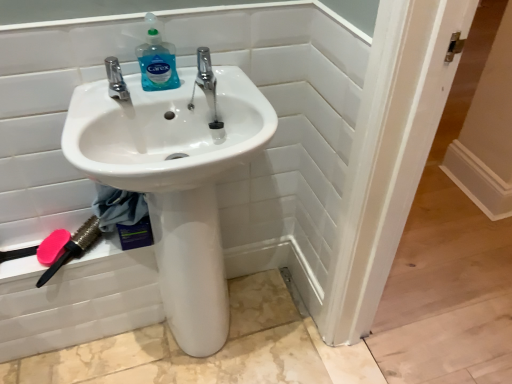
Question: Is there a large distance between pink plastic brush at lower left and translucent plastic bottle at upper center?

Choices:
 (A) no
 (B) yes

Answer: (A)

Question: From a real-world perspective, is pink plastic brush at lower left positioned over translucent plastic bottle at upper center based on gravity?

Choices:
 (A) yes
 (B) no

Answer: (B)

Question: Is pink plastic brush at lower left shorter than translucent plastic bottle at upper center?

Choices:
 (A) yes
 (B) no

Answer: (A)

Question: Considering the relative positions of pink plastic brush at lower left and translucent plastic bottle at upper center in the image provided, is pink plastic brush at lower left to the left of translucent plastic bottle at upper center from the viewer's perspective?

Choices:
 (A) no
 (B) yes

Answer: (B)

Question: Considering the relative positions of pink plastic brush at lower left and translucent plastic bottle at upper center in the image provided, is pink plastic brush at lower left behind translucent plastic bottle at upper center?

Choices:
 (A) yes
 (B) no

Answer: (A)

Question: In the image, is pink matte brush at lower left positioned in front of or behind white glossy sink at center?

Choices:
 (A) front
 (B) behind

Answer: (B)

Question: Is pink matte brush at lower left to the left or to the right of white glossy sink at center in the image?

Choices:
 (A) left
 (B) right

Answer: (A)

Question: Do you think pink matte brush at lower left is within white glossy sink at center, or outside of it?

Choices:
 (A) outside
 (B) inside

Answer: (A)

Question: In terms of size, does pink matte brush at lower left appear bigger or smaller than white glossy sink at center?

Choices:
 (A) small
 (B) big

Answer: (A)

Question: Is white glossy sink at center to the left or to the right of pink matte brush at lower left in the image?

Choices:
 (A) right
 (B) left

Answer: (A)

Question: Is point (316, 294) closer or farther from the camera than point (68, 233)?

Choices:
 (A) closer
 (B) farther

Answer: (B)

Question: Is white glossy sink at center taller or shorter than pink matte brush at lower left?

Choices:
 (A) short
 (B) tall

Answer: (B)

Question: Is white glossy sink at center inside the boundaries of pink matte brush at lower left, or outside?

Choices:
 (A) inside
 (B) outside

Answer: (B)

Question: Is polished chrome tap at center, the 1th tap positioned from the right, in front of or behind translucent plastic bottle at upper center in the image?

Choices:
 (A) behind
 (B) front

Answer: (A)

Question: From their relative heights in the image, would you say polished chrome tap at center, which ranks as the 2th tap in left-to-right order, is taller or shorter than translucent plastic bottle at upper center?

Choices:
 (A) tall
 (B) short

Answer: (B)